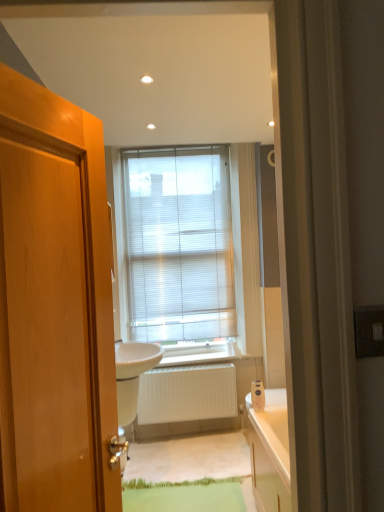
What do you see at coordinates (132, 375) in the screenshot?
I see `white glossy sink at center` at bounding box center [132, 375].

What are the coordinates of `white matte radiator at center` in the screenshot? It's located at [x=187, y=394].

From the image's perspective, which is above, white/translucent blinds at center or white glossy sink at center?

white/translucent blinds at center, from the image's perspective.

Between white/translucent blinds at center and white glossy sink at center, which one appears on the left side from the viewer's perspective?

From the viewer's perspective, white glossy sink at center appears more on the left side.

In the scene shown: Does white/translucent blinds at center have a larger size compared to white glossy sink at center?

Actually, white/translucent blinds at center might be smaller than white glossy sink at center.

From a real-world perspective, is white/translucent blinds at center positioned above or below white glossy sink at center?

white/translucent blinds at center is situated higher than white glossy sink at center in the real world.

Is silver metallic door handle at lower left oriented away from white matte radiator at center?

No, white matte radiator at center is not at the back of silver metallic door handle at lower left.

Is silver metallic door handle at lower left in front of or behind white matte radiator at center in the image?

Visually, silver metallic door handle at lower left is located in front of white matte radiator at center.

Between silver metallic door handle at lower left and white matte radiator at center, which one has larger size?

white matte radiator at center is bigger.

Is white matte radiator at center positioned in front of silver metallic door handle at lower left?

No.

Between white matte radiator at center and silver metallic door handle at lower left, which one has smaller width?

Thinner between the two is white matte radiator at center.

Consider the image. From a real-world perspective, who is located higher, white matte radiator at center or silver metallic door handle at lower left?

white matte radiator at center, from a real-world perspective.

From the picture: Is silver metallic door handle at lower left completely or partially inside white matte radiator at center?

No, silver metallic door handle at lower left is not inside white matte radiator at center.

Would you say white/translucent blinds at center is a long distance from silver metallic door handle at lower left?

That's right, there is a large distance between white/translucent blinds at center and silver metallic door handle at lower left.

Is point (191, 307) farther from viewer compared to point (123, 451)?

Yes, it is.

Considering the positions of objects white/translucent blinds at center and silver metallic door handle at lower left in the image provided, who is more to the right, white/translucent blinds at center or silver metallic door handle at lower left?

Positioned to the right is white/translucent blinds at center.

Is white/translucent blinds at center turned away from silver metallic door handle at lower left?

That's not correct — white/translucent blinds at center is not looking away from silver metallic door handle at lower left.

Is white matte radiator at center bigger or smaller than white glossy sink at center?

Clearly, white matte radiator at center is smaller in size than white glossy sink at center.

Is white matte radiator at center inside or outside of white glossy sink at center?

white matte radiator at center exists outside the volume of white glossy sink at center.

Looking at this image, does white matte radiator at center have a greater height compared to white glossy sink at center?

Yes, white matte radiator at center is taller than white glossy sink at center.

Are white matte radiator at center and white/translucent blinds at center located far from each other?

white matte radiator at center is near white/translucent blinds at center, not far away.

Does white matte radiator at center appear on the left side of white/translucent blinds at center?

Incorrect, white matte radiator at center is not on the left side of white/translucent blinds at center.

Which of these two, white matte radiator at center or white/translucent blinds at center, is thinner?

A: white/translucent blinds at center.

From the picture: Considering the sizes of white matte radiator at center and white/translucent blinds at center in the image, is white matte radiator at center bigger or smaller than white/translucent blinds at center?

Clearly, white matte radiator at center is smaller in size than white/translucent blinds at center.

What's the angular difference between white glossy sink at center and white/translucent blinds at center's facing directions?

The angle between the facing direction of white glossy sink at center and the facing direction of white/translucent blinds at center is 90.6 degrees.

Is point (149, 348) less distant than point (200, 200)?

Yes.

Considering the relative sizes of white glossy sink at center and white/translucent blinds at center in the image provided, is white glossy sink at center thinner than white/translucent blinds at center?

Incorrect, the width of white glossy sink at center is not less than that of white/translucent blinds at center.

Find the location of a particular element. This screenshot has width=384, height=512. window blind behind the white glossy sink at center is located at coordinates pos(178,244).

Where is `sink below the white/translucent blinds at center (from the image's perspective)`? sink below the white/translucent blinds at center (from the image's perspective) is located at coordinates (132, 375).

This screenshot has height=512, width=384. I want to click on door handle below the white matte radiator at center (from a real-world perspective), so click(118, 453).

Looking at the image, which one is located closer to white glossy sink at center, silver metallic door handle at lower left or white matte radiator at center?

white matte radiator at center lies closer to white glossy sink at center than the other object.

Which object lies nearer to the anchor point white/translucent blinds at center, silver metallic door handle at lower left or white matte radiator at center?

white matte radiator at center.

Based on their spatial positions, is white glossy sink at center or white matte radiator at center closer to silver metallic door handle at lower left?

white glossy sink at center.

Based on their spatial positions, is white matte radiator at center or silver metallic door handle at lower left closer to white/translucent blinds at center?

white matte radiator at center.

Which object lies nearer to the anchor point white matte radiator at center, white/translucent blinds at center or white glossy sink at center?

Among the two, white glossy sink at center is located nearer to white matte radiator at center.

Based on their spatial positions, is white matte radiator at center or white glossy sink at center further from white/translucent blinds at center?

Among the two, white matte radiator at center is located further to white/translucent blinds at center.

Considering their positions, is white/translucent blinds at center positioned further to white glossy sink at center than white matte radiator at center?

The object further to white glossy sink at center is white/translucent blinds at center.

Which object lies nearer to the anchor point white glossy sink at center, white matte radiator at center or white/translucent blinds at center?

white matte radiator at center lies closer to white glossy sink at center than the other object.

Find the location of `door handle between white glossy sink at center and white matte radiator at center in the front-back direction`. door handle between white glossy sink at center and white matte radiator at center in the front-back direction is located at coordinates (118, 453).

Where is `sink between white/translucent blinds at center and silver metallic door handle at lower left vertically`? The height and width of the screenshot is (512, 384). sink between white/translucent blinds at center and silver metallic door handle at lower left vertically is located at coordinates (132, 375).

Locate an element on the screen. This screenshot has height=512, width=384. sink between white/translucent blinds at center and white matte radiator at center in the up-down direction is located at coordinates (132, 375).

Identify the location of radiator that lies between white/translucent blinds at center and silver metallic door handle at lower left from top to bottom. (187, 394).